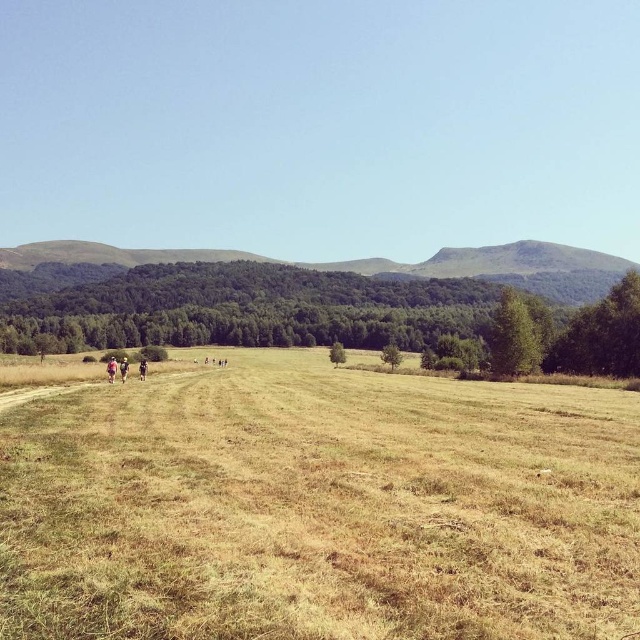
Question: Which of the following is the closest to the observer?

Choices:
 (A) light brown fabric jacket at left
 (B) light blue fabric at left
 (C) brown grassy field at center
 (D) light brown leather jacket at center

Answer: (C)

Question: Among these points, which one is nearest to the camera?

Choices:
 (A) (140, 364)
 (B) (109, 371)
 (C) (225, 576)
 (D) (122, 372)

Answer: (C)

Question: Which point appears farthest from the camera in this image?

Choices:
 (A) (138, 369)
 (B) (289, 468)
 (C) (113, 374)
 (D) (122, 371)

Answer: (A)

Question: Is brown grassy field at center smaller than light brown fabric jacket at left?

Choices:
 (A) yes
 (B) no

Answer: (A)

Question: Considering the relative positions of brown grassy field at center and light blue fabric at left in the image provided, where is brown grassy field at center located with respect to light blue fabric at left?

Choices:
 (A) left
 (B) right

Answer: (B)

Question: Considering the relative positions of brown grassy field at center and light brown leather jacket at center in the image provided, where is brown grassy field at center located with respect to light brown leather jacket at center?

Choices:
 (A) below
 (B) above

Answer: (B)